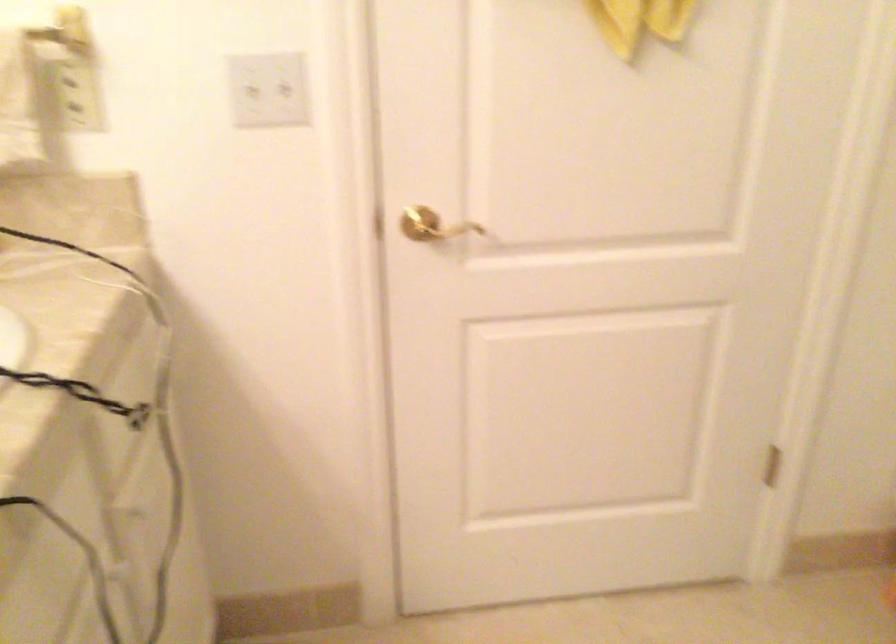
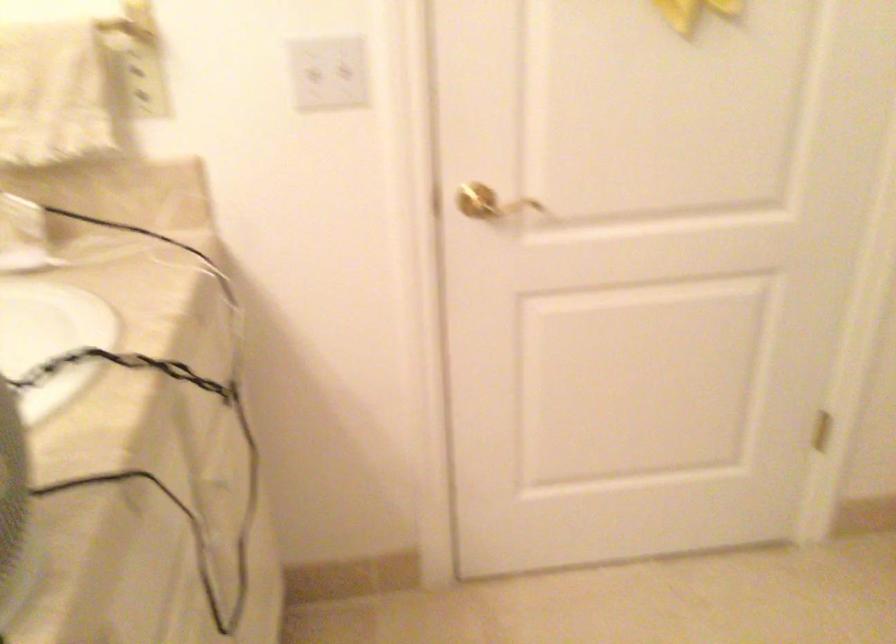
In the second image, find the point that corresponds to (x=263, y=87) in the first image.

(323, 69)